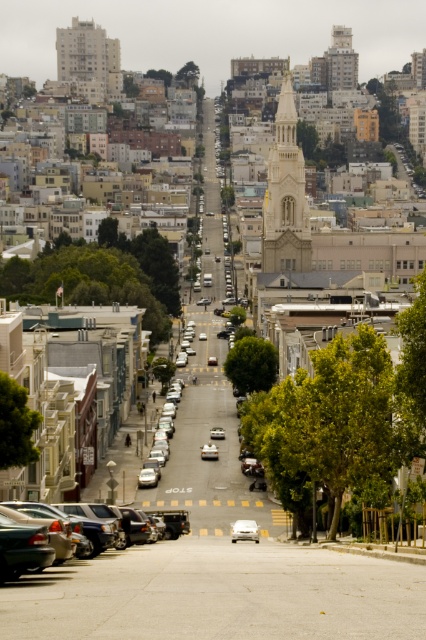
Consider the image. Can you confirm if gold textured tower at center is positioned to the left of white stone tower at upper center?

Correct, you'll find gold textured tower at center to the left of white stone tower at upper center.

Which is more to the right, gold textured tower at center or white stone tower at upper center?

white stone tower at upper center is more to the right.

Is point (276, 257) positioned in front of point (328, 68)?

That is True.

Where is `gold textured tower at center`? gold textured tower at center is located at coordinates (285, 195).

Who is positioned more to the left, matte black sedan at lower left or white matte car at center?

matte black sedan at lower left

Who is taller, matte black sedan at lower left or white matte car at center?

matte black sedan at lower left

Who is more forward, (x=103, y=525) or (x=244, y=520)?

Point (x=103, y=525) is in front.

Identify the location of matte black sedan at lower left. (92, 515).

Is point (285, 244) less distant than point (115, 64)?

Yes, point (285, 244) is in front of point (115, 64).

Measure the distance from gold textured tower at center to gray concrete building at upper left.

gold textured tower at center is 978.42 feet away from gray concrete building at upper left.

This screenshot has height=640, width=426. What do you see at coordinates (285, 195) in the screenshot?
I see `gold textured tower at center` at bounding box center [285, 195].

This screenshot has height=640, width=426. I want to click on gold textured tower at center, so click(x=285, y=195).